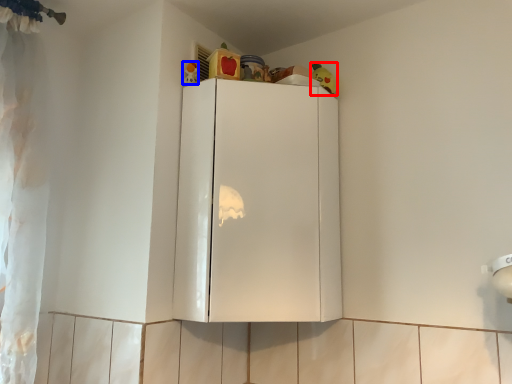
Question: Which of the following is the farthest to the observer, toy (highlighted by a red box) or toy (highlighted by a blue box)?

Choices:
 (A) toy
 (B) toy

Answer: (A)